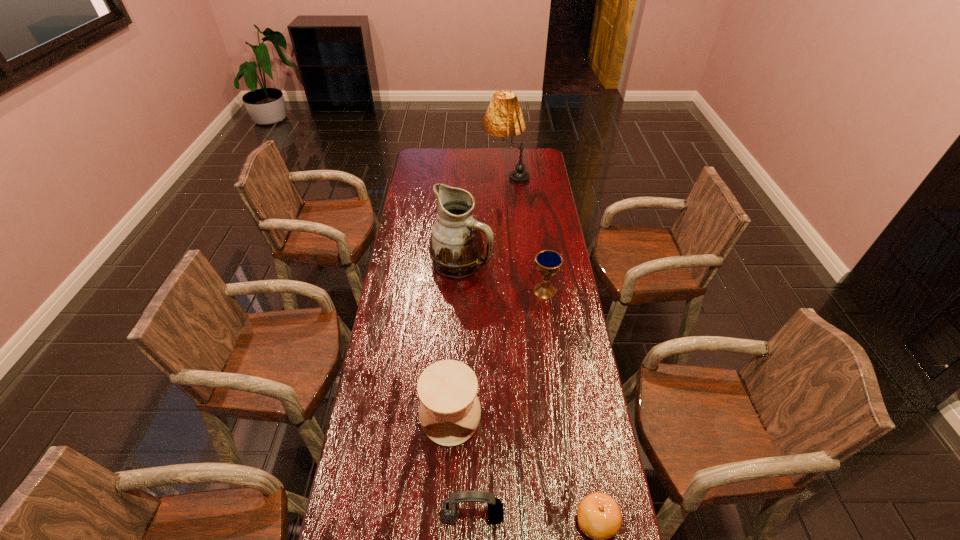
This screenshot has height=540, width=960. In the image, there is a desktop. Find the location of `vacant space at the right edge`. vacant space at the right edge is located at coordinates (566, 462).

This screenshot has width=960, height=540. Identify the location of vacant space at the far left corner. (434, 149).

Find the location of `vacant area between the fifth tallest object and the tallest object`. vacant area between the fifth tallest object and the tallest object is located at coordinates (489, 345).

This screenshot has height=540, width=960. I want to click on vacant region between the pottery and the tallest object, so click(478, 297).

Find the location of a particular element. This screenshot has width=960, height=540. vacant area between the tallest object and the headset is located at coordinates (489, 345).

Locate an element on the screen. This screenshot has width=960, height=540. vacant space that's between the farthest object and the chalice is located at coordinates (525, 233).

Find the location of a particular element. Image resolution: width=960 pixels, height=540 pixels. vacant space that's between the chalice and the lampshade is located at coordinates (525, 233).

Where is `object that is the fourth nearest to the fifth tallest object`? Image resolution: width=960 pixels, height=540 pixels. object that is the fourth nearest to the fifth tallest object is located at coordinates (456, 248).

Find the location of a particular element. The image size is (960, 540). object that is the second closest to the third tallest object is located at coordinates (599, 517).

Locate an element on the screen. Image resolution: width=960 pixels, height=540 pixels. vacant space that satisfies the following two spatial constraints: 1. on the front-facing side of the tallest object; 2. at the open side of the fourth shortest object is located at coordinates (523, 419).